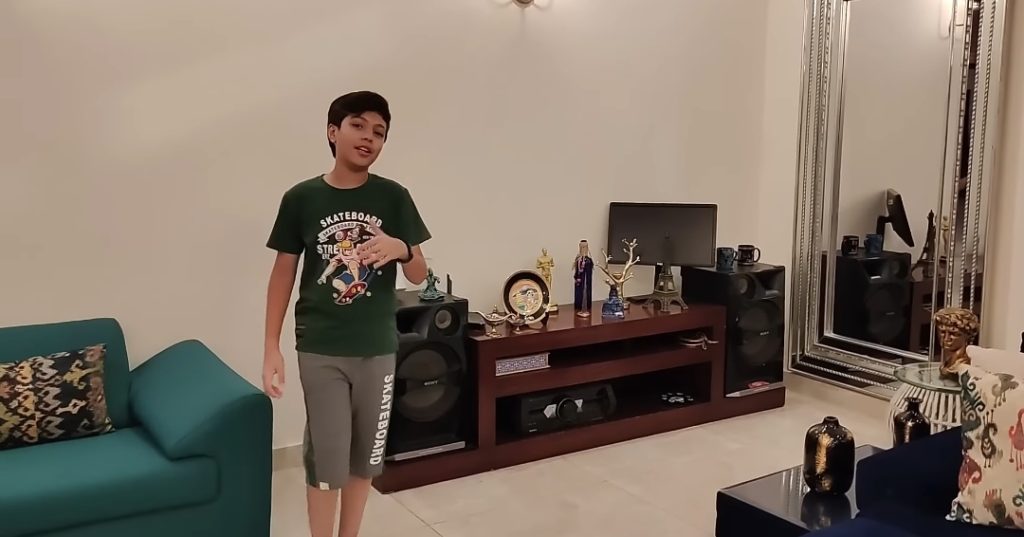
You are a GUI agent. You are given a task and a screenshot of the screen. Output one action in this format:
    pyautogui.click(x=<x>, y=<y>)
    Task: Click on the green couch
    The image size is (1024, 537).
    Given the screenshot: What is the action you would take?
    pyautogui.click(x=60, y=502)